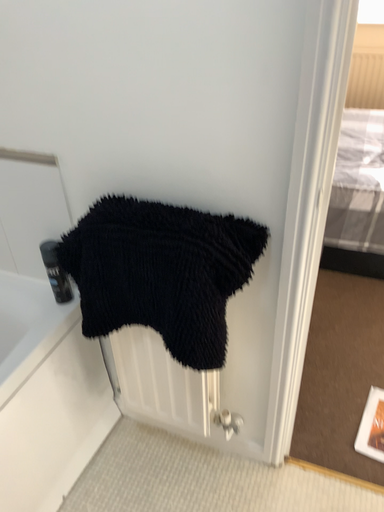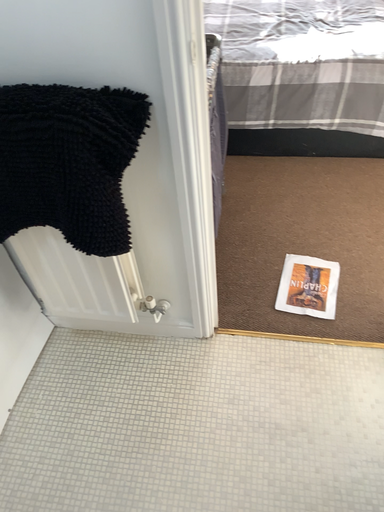
Question: How did the camera likely rotate when shooting the video?

Choices:
 (A) rotated right
 (B) rotated left

Answer: (A)